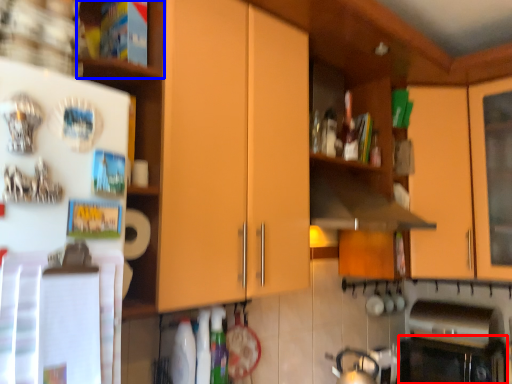
Question: Which object appears farthest to the camera in this image, oven (highlighted by a red box) or shelf (highlighted by a blue box)?

Choices:
 (A) oven
 (B) shelf

Answer: (A)